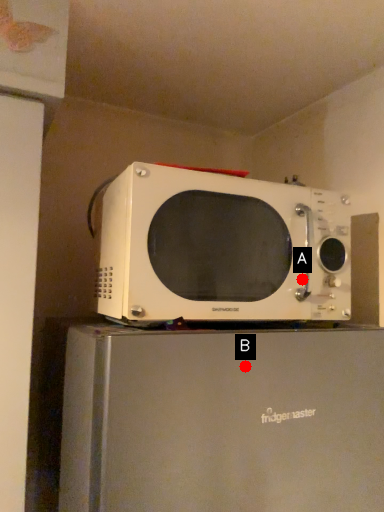
Question: Two points are circled on the image, labeled by A and B beside each circle. Which point is further to the camera?

Choices:
 (A) A is further
 (B) B is further

Answer: (A)